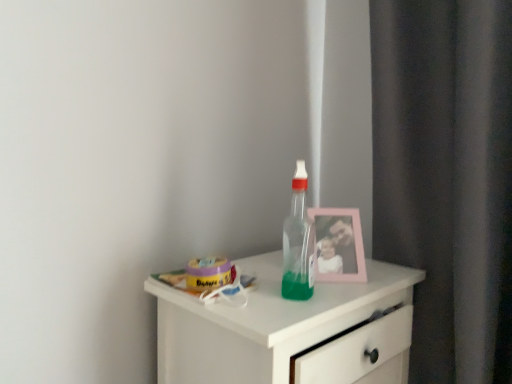
Question: From a real-world perspective, is white glossy chest of drawers at center located beneath transparent plastic bottle at center?

Choices:
 (A) no
 (B) yes

Answer: (B)

Question: Considering the relative positions of white glossy chest of drawers at center and transparent plastic bottle at center in the image provided, is white glossy chest of drawers at center to the right of transparent plastic bottle at center from the viewer's perspective?

Choices:
 (A) no
 (B) yes

Answer: (A)

Question: Is white glossy chest of drawers at center shorter than transparent plastic bottle at center?

Choices:
 (A) yes
 (B) no

Answer: (B)

Question: Is transparent plastic bottle at center surrounded by white glossy chest of drawers at center?

Choices:
 (A) yes
 (B) no

Answer: (B)

Question: Can you confirm if white glossy chest of drawers at center is positioned to the left of transparent plastic bottle at center?

Choices:
 (A) yes
 (B) no

Answer: (A)

Question: From the image's perspective, does white glossy chest of drawers at center appear higher than transparent plastic bottle at center?

Choices:
 (A) yes
 (B) no

Answer: (B)

Question: Can you confirm if transparent plastic bottle at center is bigger than white glossy chest of drawers at center?

Choices:
 (A) no
 (B) yes

Answer: (A)

Question: Is transparent plastic bottle at center turned away from white glossy chest of drawers at center?

Choices:
 (A) yes
 (B) no

Answer: (B)

Question: From the image's perspective, is transparent plastic bottle at center under white glossy chest of drawers at center?

Choices:
 (A) no
 (B) yes

Answer: (A)

Question: Does transparent plastic bottle at center have a greater width compared to white glossy chest of drawers at center?

Choices:
 (A) yes
 (B) no

Answer: (B)

Question: Is transparent plastic bottle at center far from white glossy chest of drawers at center?

Choices:
 (A) yes
 (B) no

Answer: (B)

Question: From the image's perspective, is transparent plastic bottle at center above white glossy chest of drawers at center?

Choices:
 (A) no
 (B) yes

Answer: (B)

Question: From the image's perspective, is pink plastic picture frame at upper right over transparent plastic bottle at center?

Choices:
 (A) yes
 (B) no

Answer: (B)